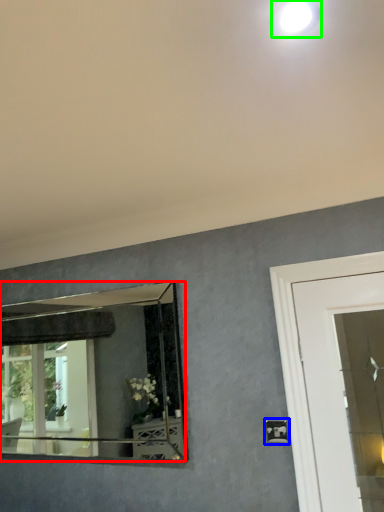
Question: Which object is positioned farthest from mirror (highlighted by a red box)? Select from light switch (highlighted by a blue box) and droplight (highlighted by a green box).

Choices:
 (A) light switch
 (B) droplight

Answer: (B)